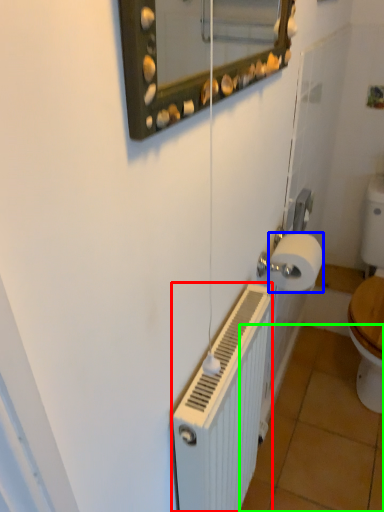
Question: Considering the real-world distances, which object is farthest from radiator (highlighted by a red box)? toilet paper (highlighted by a blue box) or tile (highlighted by a green box)?

Choices:
 (A) toilet paper
 (B) tile

Answer: (B)